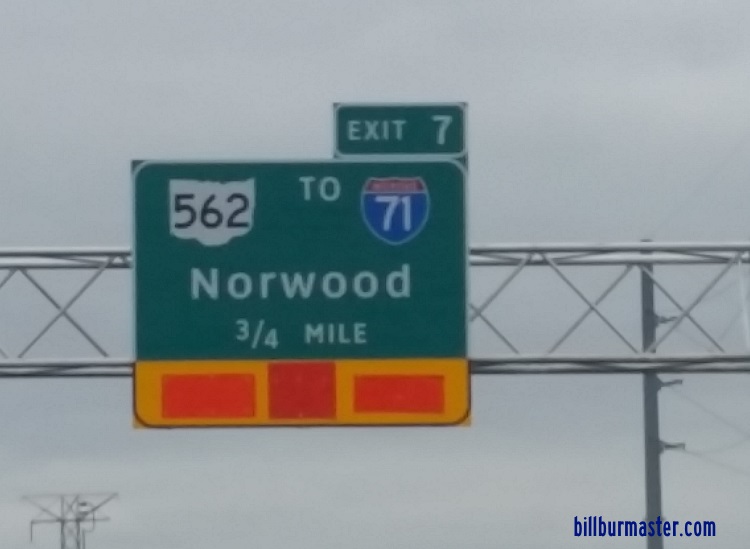
This screenshot has width=750, height=549. In order to click on support beam in this screenshot , I will do coord(565,248).